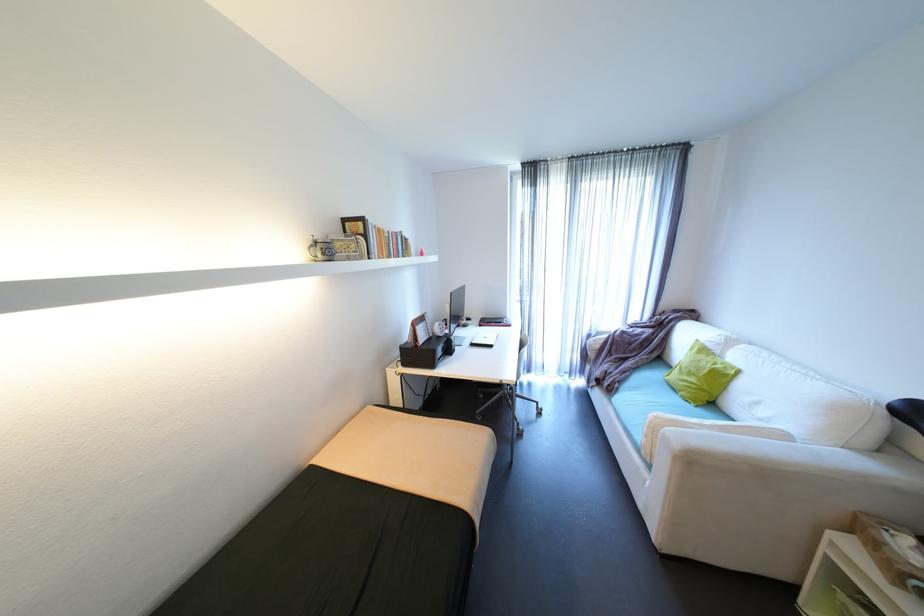
The width and height of the screenshot is (924, 616). Describe the element at coordinates (797, 475) in the screenshot. I see `a sofa armrest` at that location.